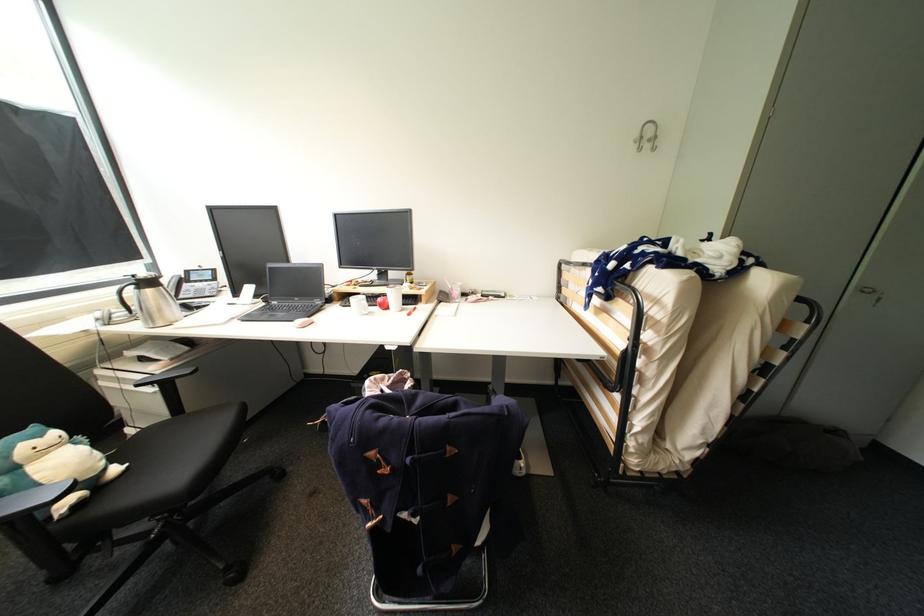
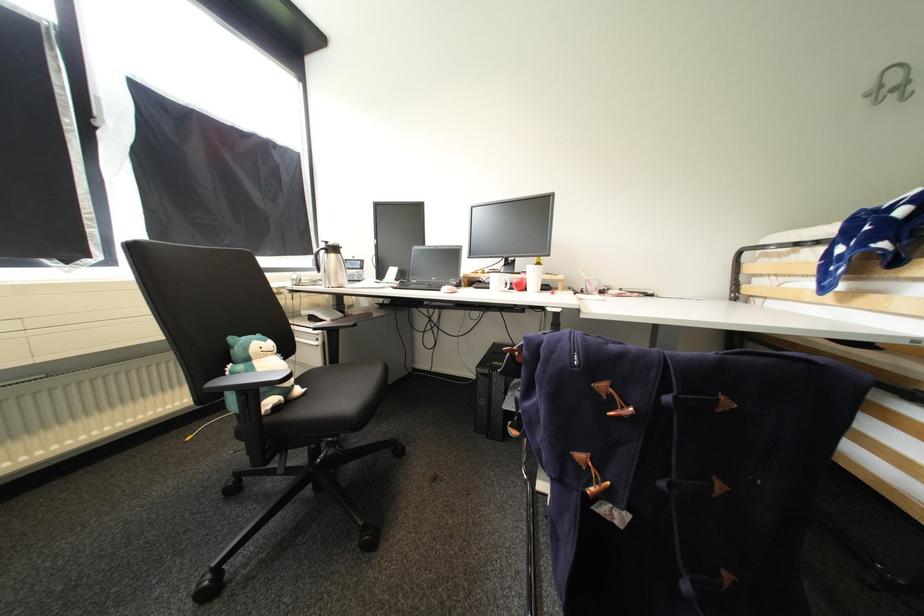
Find the pixel in the second image that matches point (660, 140) in the first image.

(912, 84)